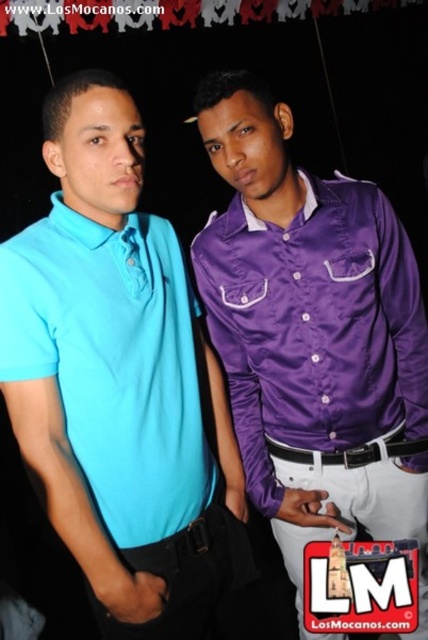
This screenshot has width=428, height=640. I want to click on matte blue polo shirt at left, so click(118, 381).

Who is shorter, matte blue polo shirt at left or white leather belt at center?

white leather belt at center is shorter.

This screenshot has width=428, height=640. What are the coordinates of `matte blue polo shirt at left` in the screenshot? It's located at (118, 381).

This screenshot has width=428, height=640. In order to click on purple satin shirt at right in this screenshot , I will do `click(314, 337)`.

Can you confirm if purple satin shirt at right is positioned above white leather belt at center?

Indeed, purple satin shirt at right is positioned over white leather belt at center.

Does point (261, 220) come closer to viewer compared to point (403, 444)?

That is True.

Where is `purple satin shirt at right`? purple satin shirt at right is located at coordinates (314, 337).

Does matte blue polo shirt at left come behind purple satin shirt at right?

No, it is not.

Can you confirm if matte blue polo shirt at left is positioned below purple satin shirt at right?

Indeed, matte blue polo shirt at left is positioned under purple satin shirt at right.

Who is more distant from viewer, (229, 584) or (320, 314)?

Positioned behind is point (229, 584).

Where is `matte blue polo shirt at left`? This screenshot has width=428, height=640. matte blue polo shirt at left is located at coordinates coord(118,381).